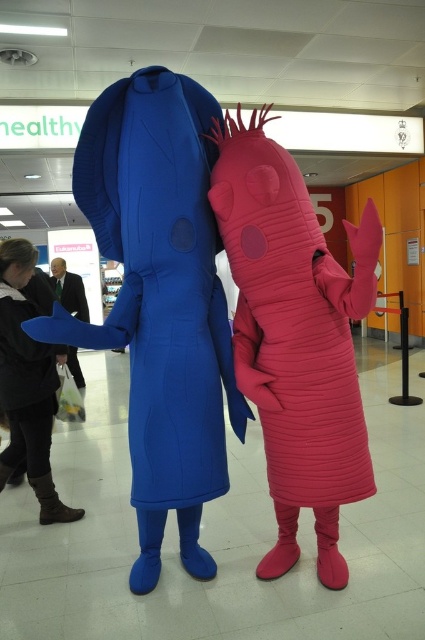
Question: Does brown leather boots at lower left appear on the right side of matte black suit at center?

Choices:
 (A) no
 (B) yes

Answer: (B)

Question: Which object is the farthest from the matte blue costume at center?

Choices:
 (A) brown leather boots at lower left
 (B) rubber pink worm at center

Answer: (A)

Question: Which is farther from the matte blue costume at center?

Choices:
 (A) rubber pink worm at center
 (B) matte black suit at center
 (C) brown leather boots at lower left

Answer: (B)

Question: Based on their relative distances, which object is nearer to the rubber pink worm at center?

Choices:
 (A) matte black suit at center
 (B) matte blue costume at center
 (C) brown leather boots at lower left

Answer: (B)

Question: Is brown leather boots at lower left positioned in front of matte black suit at center?

Choices:
 (A) yes
 (B) no

Answer: (A)

Question: Is rubber pink worm at center to the right of brown leather boots at lower left from the viewer's perspective?

Choices:
 (A) no
 (B) yes

Answer: (B)